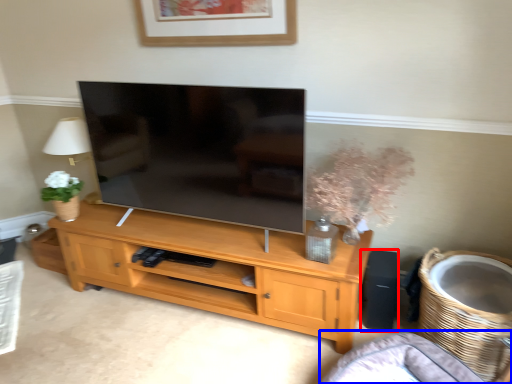
Question: Which of the following is the farthest to the observer, speaker (highlighted by a red box) or couch (highlighted by a blue box)?

Choices:
 (A) speaker
 (B) couch

Answer: (A)